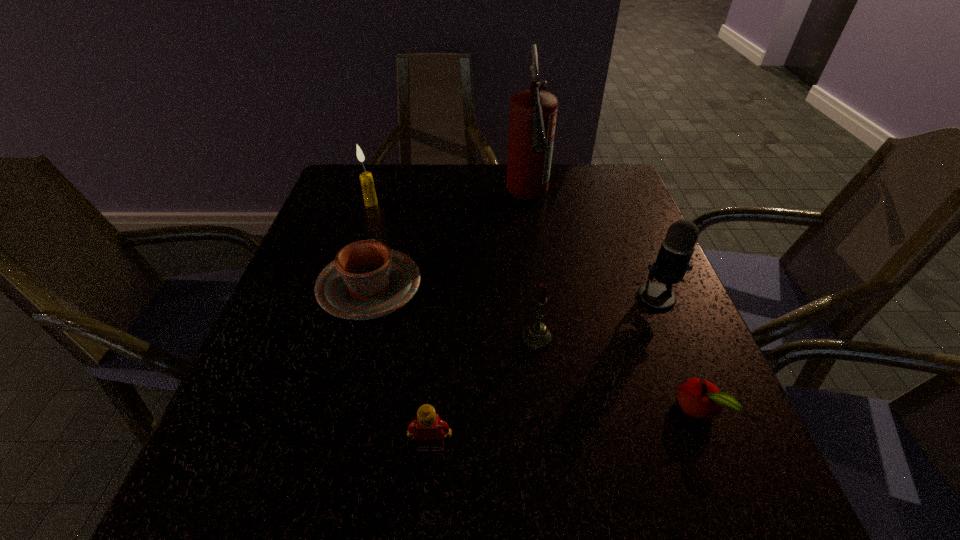
At what (x,y) coordinates should I click in order to perform the action: click on candle at the far edge. Please return your answer as a coordinate pair (x, y). This screenshot has width=960, height=540. Looking at the image, I should click on (366, 179).

Locate an element on the screen. The height and width of the screenshot is (540, 960). candle present at the left edge is located at coordinates (366, 179).

The height and width of the screenshot is (540, 960). Find the location of `chinaware that is at the left edge`. chinaware that is at the left edge is located at coordinates (367, 280).

Where is `microphone at the right edge`? The image size is (960, 540). microphone at the right edge is located at coordinates (672, 263).

I want to click on apple located in the right edge section of the desktop, so click(x=700, y=399).

In order to click on object that is at the far left corner in this screenshot , I will do `click(366, 179)`.

The width and height of the screenshot is (960, 540). In the image, there is a desktop. Find the location of `vacant space at the far edge`. vacant space at the far edge is located at coordinates (456, 171).

In the image, there is a desktop. Where is `free space at the near edge`? free space at the near edge is located at coordinates (348, 470).

This screenshot has width=960, height=540. Find the location of `free space at the left edge`. free space at the left edge is located at coordinates (318, 349).

At what (x,y) coordinates should I click in order to perform the action: click on free spot at the right edge of the desktop. Please return your answer as a coordinate pair (x, y). Image resolution: width=960 pixels, height=540 pixels. Looking at the image, I should click on (636, 383).